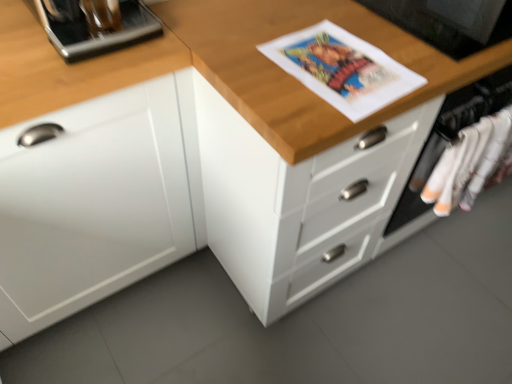
Question: Would you say wooden chest of drawers at center is to the left or to the right of black glossy monitor at upper right, acting as the second appliance starting from the left, in the picture?

Choices:
 (A) right
 (B) left

Answer: (A)

Question: From the image's perspective, is wooden chest of drawers at center positioned above or below black glossy monitor at upper right, acting as the second appliance starting from the left?

Choices:
 (A) below
 (B) above

Answer: (A)

Question: Based on their relative distances, which object is nearer to the white matte cabinet at left?

Choices:
 (A) white cotton socks at right
 (B) black glossy monitor at upper right, marked as the first appliance in a right-to-left arrangement
 (C) wooden chest of drawers at center
 (D) metallic silver coffee machine at upper left, placed as the first appliance when sorted from left to right

Answer: (D)

Question: Considering the real-world distances, which object is farthest from the metallic silver coffee machine at upper left, which ranks as the second appliance in right-to-left order?

Choices:
 (A) black glossy monitor at upper right, acting as the second appliance starting from the left
 (B) white cotton socks at right
 (C) white matte cabinet at left
 (D) wooden chest of drawers at center

Answer: (B)